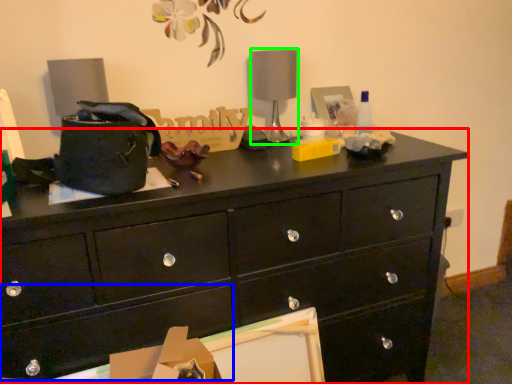
Question: Which object is positioned closest to chest of drawers (highlighted by a red box)? Select from drawer (highlighted by a blue box) and table lamp (highlighted by a green box).

Choices:
 (A) drawer
 (B) table lamp

Answer: (A)